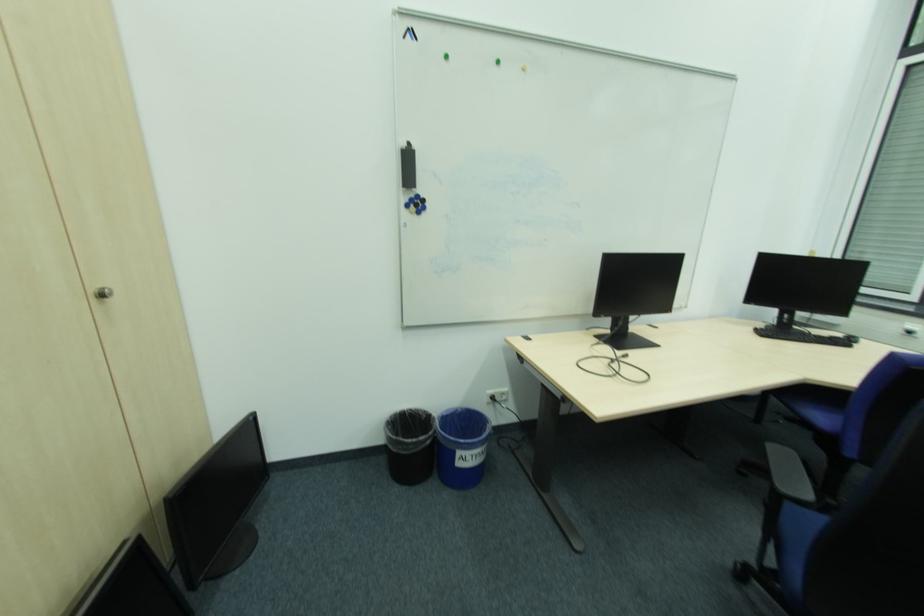
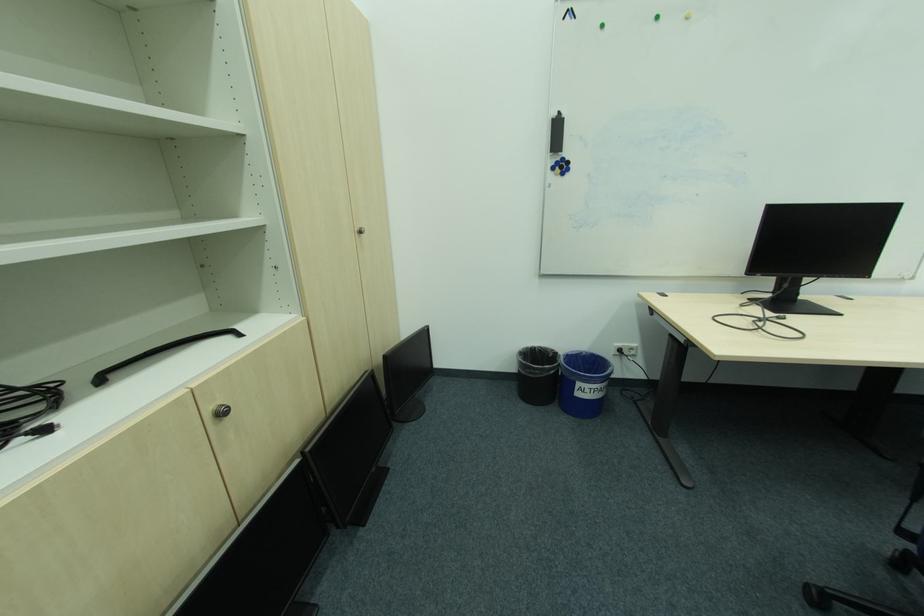
Where in the second image is the point corresponding to point (417, 410) from the first image?

(546, 347)